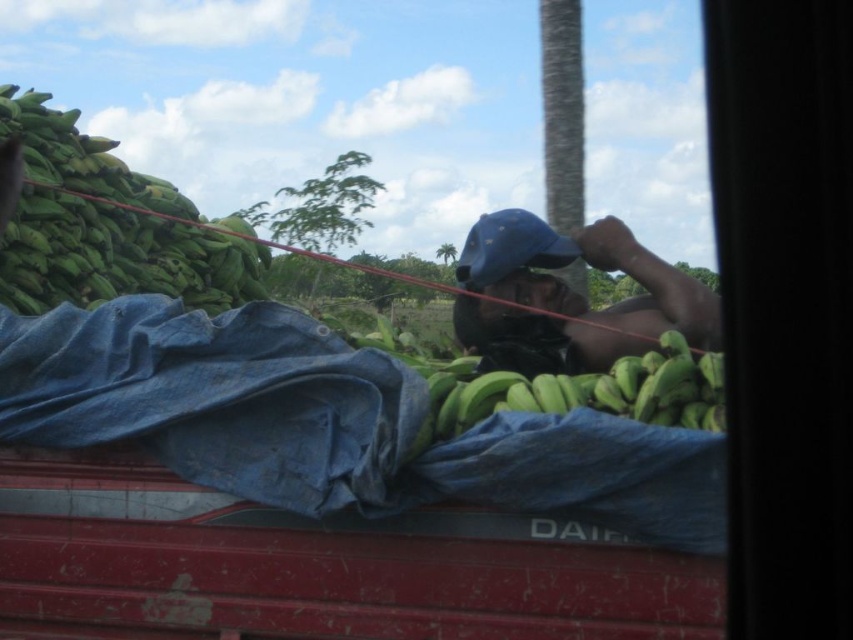
Is green matte bananas at upper left bigger than blue fabric cap at center?

Yes.

Can you confirm if green matte bananas at upper left is positioned to the right of blue fabric cap at center?

Incorrect, green matte bananas at upper left is not on the right side of blue fabric cap at center.

Who is more forward, (0, 124) or (518, 241)?

Point (518, 241) is in front.

Locate an element on the screen. The width and height of the screenshot is (853, 640). green matte bananas at upper left is located at coordinates (119, 257).

Is blue fabric cap at center wider than green matte bananas at center?

Incorrect, blue fabric cap at center's width does not surpass green matte bananas at center's.

Is point (558, 262) farther from camera compared to point (527, 404)?

That is True.

Locate an element on the screen. Image resolution: width=853 pixels, height=640 pixels. blue fabric cap at center is located at coordinates (589, 264).

You are a GUI agent. You are given a task and a screenshot of the screen. Output one action in this format:
    pyautogui.click(x=<x>, y=<y>)
    Task: Click on the green matte bananas at upper left
    The image size is (853, 640).
    Given the screenshot: What is the action you would take?
    pyautogui.click(x=119, y=257)

Based on the photo, who is more distant from viewer, (38, 221) or (611, 380)?

The point (38, 221) is more distant.

Locate an element on the screen. The image size is (853, 640). green matte bananas at upper left is located at coordinates (119, 257).